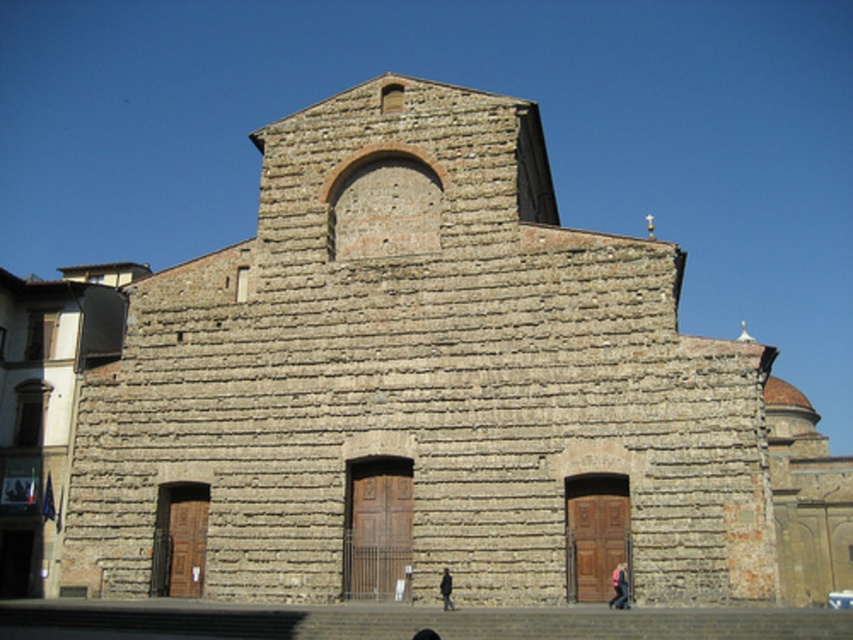
You are standing in front of the stone building and see the pink fabric at lower right and the dark brown leather shoe at lower center. Which object is closer to you?

The pink fabric at lower right is closer to you because it is further to the viewer than the dark brown leather shoe at lower center.

You are standing in front of the large stone building and notice a pink fabric at lower right and a dark brown leather shoe at lower center. Which object is larger in size?

The pink fabric at lower right is bigger than the dark brown leather shoe at lower center.

You are standing at the entrance of the large stone building and notice a pink fabric at lower right and a dark gray jacket at center. If you want to pick up both items, which one should you move towards first to minimize your walking distance?

The pink fabric at lower right and dark gray jacket at center are 6.91 meters apart. To minimize walking distance, you should move towards the closer item first. However, without knowing your starting position, it is impossible to determine which item is closer.